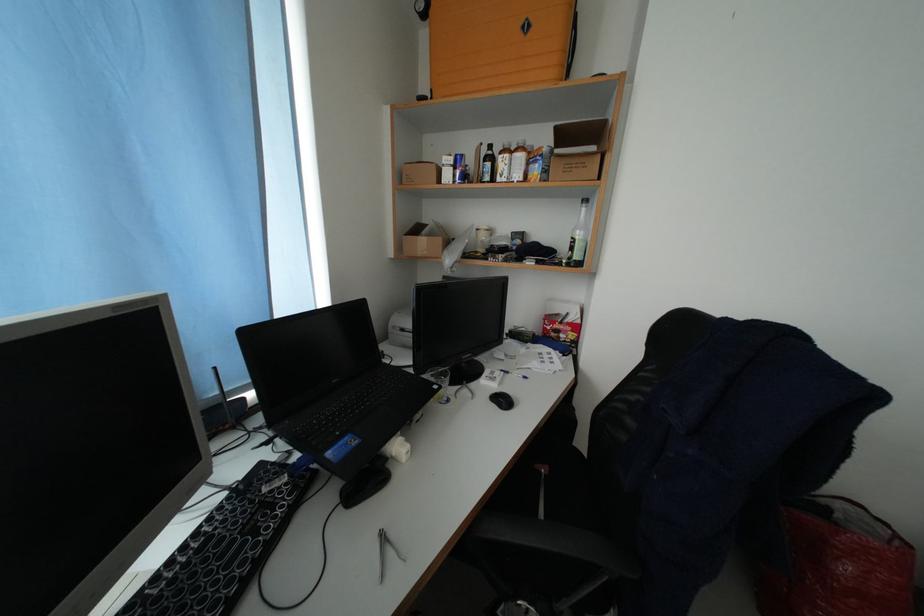
Locate an element on the screen. The height and width of the screenshot is (616, 924). black chair armrest is located at coordinates (554, 541).